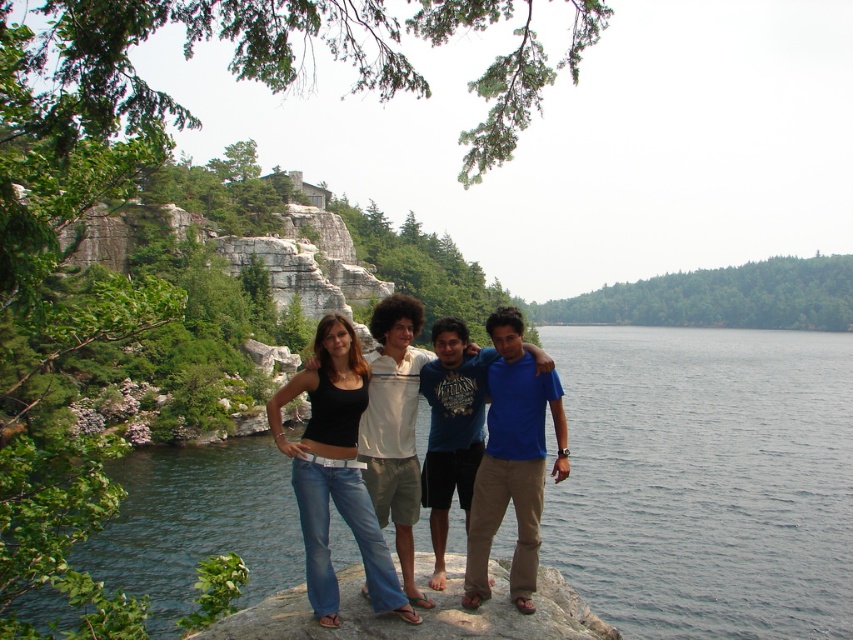
Question: Is blue water at center to the right of smooth gray rock at lower center from the viewer's perspective?

Choices:
 (A) yes
 (B) no

Answer: (A)

Question: Which of the following is the closest to the observer?

Choices:
 (A) click(x=575, y=600)
 (B) click(x=350, y=484)
 (C) click(x=402, y=305)

Answer: (A)

Question: Which point appears closest to the camera in this image?

Choices:
 (A) (743, 516)
 (B) (593, 637)

Answer: (B)

Question: Estimate the real-world distances between objects in this image. Which object is farther from the blue water at center?

Choices:
 (A) black denim jeans at center
 (B) smooth gray rock at lower center
 (C) white textured shirt at center
 (D) blue cotton shirt at center

Answer: (C)

Question: Can you confirm if blue water at center is positioned above smooth gray rock at lower center?

Choices:
 (A) yes
 (B) no

Answer: (A)

Question: Is blue water at center closer to the viewer compared to smooth gray rock at lower center?

Choices:
 (A) no
 (B) yes

Answer: (A)